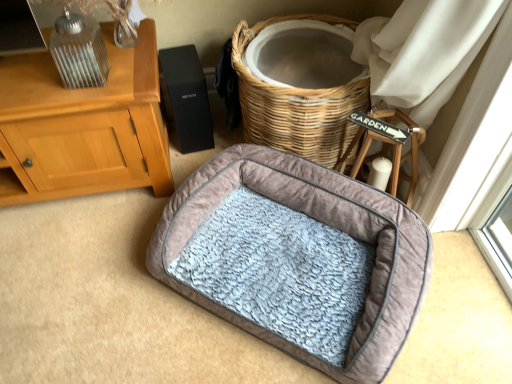
Image resolution: width=512 pixels, height=384 pixels. What do you see at coordinates (297, 258) in the screenshot?
I see `velvet-like gray dog bed at center` at bounding box center [297, 258].

Measure the distance between velvet-like gray dog bed at center and camera.

A distance of 1.06 meters exists between velvet-like gray dog bed at center and camera.

You are a GUI agent. You are given a task and a screenshot of the screen. Output one action in this format:
    pyautogui.click(x=<x>, y=<y>)
    Task: Click on the velvet-like gray dog bed at center
    The image size is (512, 384).
    Given the screenshot: What is the action you would take?
    pyautogui.click(x=297, y=258)

The image size is (512, 384). Describe the element at coordinates (296, 105) in the screenshot. I see `woven wicker basket at center` at that location.

The width and height of the screenshot is (512, 384). I want to click on woven wicker basket at center, so click(296, 105).

At what (x,y) coordinates should I click in order to perform the action: click on velvet-like gray dog bed at center. Please return your answer as a coordinate pair (x, y). Looking at the image, I should click on (297, 258).

Is velvet-like gray dog bed at center at the right side of woven wicker basket at center?

No, velvet-like gray dog bed at center is not to the right of woven wicker basket at center.

Which is in front, velvet-like gray dog bed at center or woven wicker basket at center?

Positioned in front is velvet-like gray dog bed at center.

Consider the image. Which point is more distant from viewer, (211, 310) or (244, 128)?

Positioned behind is point (244, 128).

From the image's perspective, which is below, velvet-like gray dog bed at center or woven wicker basket at center?

From the image's view, velvet-like gray dog bed at center is below.

From a real-world perspective, which object stands above the other?

woven wicker basket at center.

Is velvet-like gray dog bed at center wider than woven wicker basket at center?

Correct, the width of velvet-like gray dog bed at center exceeds that of woven wicker basket at center.

Does velvet-like gray dog bed at center have a greater height compared to woven wicker basket at center?

Incorrect, the height of velvet-like gray dog bed at center is not larger of that of woven wicker basket at center.

Between velvet-like gray dog bed at center and woven wicker basket at center, which one has larger size?

woven wicker basket at center is bigger.

Would you say velvet-like gray dog bed at center is outside woven wicker basket at center?

Absolutely, velvet-like gray dog bed at center is external to woven wicker basket at center.

Is velvet-like gray dog bed at center next to woven wicker basket at center and touching it?

No.

Could you tell me if velvet-like gray dog bed at center is facing woven wicker basket at center?

No, velvet-like gray dog bed at center is not facing towards woven wicker basket at center.

This screenshot has width=512, height=384. I want to click on basket that appears on the right of velvet-like gray dog bed at center, so click(x=296, y=105).

Is woven wicker basket at center to the right of velvet-like gray dog bed at center from the viewer's perspective?

Indeed, woven wicker basket at center is positioned on the right side of velvet-like gray dog bed at center.

Considering the positions of objects woven wicker basket at center and velvet-like gray dog bed at center in the image provided, who is behind, woven wicker basket at center or velvet-like gray dog bed at center?

woven wicker basket at center.

Is point (253, 116) positioned before point (256, 323)?

No, (253, 116) is behind (256, 323).

From the image's perspective, would you say woven wicker basket at center is shown under velvet-like gray dog bed at center?

No, from the image's perspective, woven wicker basket at center is not beneath velvet-like gray dog bed at center.

From a real-world perspective, does woven wicker basket at center stand above velvet-like gray dog bed at center?

Indeed, from a real-world perspective, woven wicker basket at center stands above velvet-like gray dog bed at center.

Which of these two, woven wicker basket at center or velvet-like gray dog bed at center, is thinner?

woven wicker basket at center.

Who is taller, woven wicker basket at center or velvet-like gray dog bed at center?

With more height is woven wicker basket at center.

Who is bigger, woven wicker basket at center or velvet-like gray dog bed at center?

woven wicker basket at center is bigger.

Is woven wicker basket at center inside the boundaries of velvet-like gray dog bed at center, or outside?

woven wicker basket at center is located beyond the bounds of velvet-like gray dog bed at center.

Is woven wicker basket at center positioned far away from velvet-like gray dog bed at center?

woven wicker basket at center is actually quite close to velvet-like gray dog bed at center.

Is woven wicker basket at center positioned with its back to velvet-like gray dog bed at center?

woven wicker basket at center is not turned away from velvet-like gray dog bed at center.

How different are the orientations of woven wicker basket at center and velvet-like gray dog bed at center in degrees?

woven wicker basket at center and velvet-like gray dog bed at center are facing 6.11 degrees away from each other.

You are a GUI agent. You are given a task and a screenshot of the screen. Output one action in this format:
    pyautogui.click(x=<x>, y=<y>)
    Task: Click on the basket behind the velvet-like gray dog bed at center
    
    Given the screenshot: What is the action you would take?
    pyautogui.click(x=296, y=105)

Locate an element on the screen. The image size is (512, 384). basket that is above the velvet-like gray dog bed at center (from the image's perspective) is located at coordinates (296, 105).

Image resolution: width=512 pixels, height=384 pixels. What are the coordinates of `basket on the right of velvet-like gray dog bed at center` in the screenshot? It's located at (296, 105).